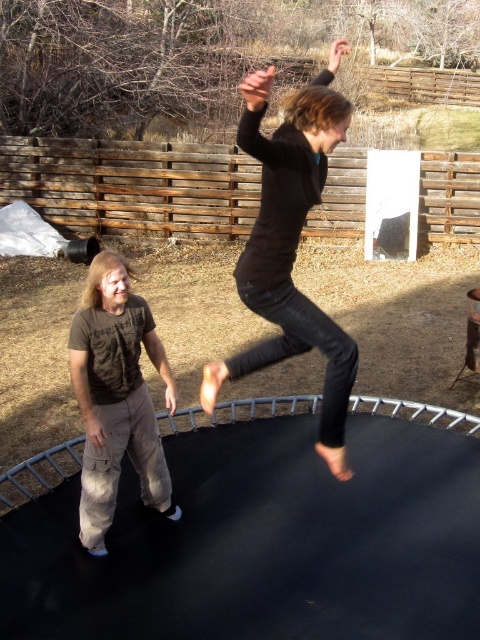
Can you confirm if black matte jeans at center is thinner than brown cotton shirt at left?

No.

Can you confirm if black matte jeans at center is smaller than brown cotton shirt at left?

No, black matte jeans at center is not smaller than brown cotton shirt at left.

Who is more forward, (280, 349) or (127, 310)?

Point (127, 310) is in front.

Locate an element on the screen. This screenshot has width=480, height=640. black matte jeans at center is located at coordinates (290, 246).